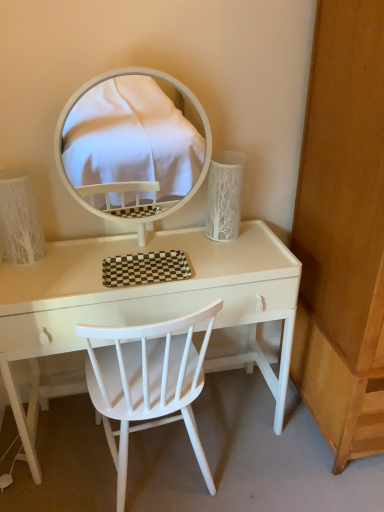
At what (x,y) coordinates should I click in order to perform the action: click on wooden dresser at right. Please return your answer as a coordinate pair (x, y). Image resolution: width=384 pixels, height=512 pixels. Looking at the image, I should click on (343, 231).

The width and height of the screenshot is (384, 512). I want to click on white glossy mirror at upper center, so click(132, 139).

What do you see at coordinates (148, 382) in the screenshot?
I see `white wood chair at center` at bounding box center [148, 382].

In order to face white glossy table at center, should I rotate leftwards or rightwards?

Rotate left and turn 4.950 degrees.

What do you see at coordinates (143, 305) in the screenshot? I see `white glossy table at center` at bounding box center [143, 305].

What do you see at coordinates (224, 195) in the screenshot? I see `white textured vase at right, which is the first table lamp from right to left` at bounding box center [224, 195].

Identify the location of wooden dresser at right. The width and height of the screenshot is (384, 512). (343, 231).

Which of these two, wooden dresser at right or white textured vase at right, which is the 2th table lamp from left to right, stands shorter?

Standing shorter between the two is white textured vase at right, which is the 2th table lamp from left to right.

From the picture: Between wooden dresser at right and white textured vase at right, which is the 2th table lamp from left to right, which one appears on the right side from the viewer's perspective?

wooden dresser at right.

Based on their sizes in the image, would you say wooden dresser at right is bigger or smaller than white textured vase at right, which is the first table lamp from right to left?

Clearly, wooden dresser at right is larger in size than white textured vase at right, which is the first table lamp from right to left.

Are wooden dresser at right and white textured vase at right, which is the first table lamp from right to left, beside each other?

No, wooden dresser at right is not touching white textured vase at right, which is the first table lamp from right to left.

The width and height of the screenshot is (384, 512). I want to click on dresser on the right of white glossy mirror at upper center, so click(343, 231).

In terms of size, does white glossy mirror at upper center appear bigger or smaller than wooden dresser at right?

Considering their sizes, white glossy mirror at upper center takes up less space than wooden dresser at right.

How distant is white glossy mirror at upper center from wooden dresser at right?

white glossy mirror at upper center is 4.98 feet away from wooden dresser at right.

Is white wood chair at center further to the viewer compared to white textured vase at right, which is the first table lamp from right to left?

No.

From the image's perspective, is white wood chair at center on top of white textured vase at right, which is the 2th table lamp from left to right?

Actually, white wood chair at center appears below white textured vase at right, which is the 2th table lamp from left to right, in the image.

Do you think white wood chair at center is within white textured vase at right, which is the first table lamp from right to left, or outside of it?

white wood chair at center is outside white textured vase at right, which is the first table lamp from right to left.

Can you tell me how much white wood chair at center and white textured vase at right, which is the first table lamp from right to left, differ in facing direction?

The angle between the facing direction of white wood chair at center and the facing direction of white textured vase at right, which is the first table lamp from right to left, is 180 degrees.

Locate an element on the screen. table lamp in front of the white textured vase at right, which is the 2th table lamp from left to right is located at coordinates (20, 219).

Which of these two, white textured lampshade at left, which appears as the 2th table lamp when viewed from the right, or white textured vase at right, which is the 2th table lamp from left to right, is bigger?

white textured vase at right, which is the 2th table lamp from left to right, is bigger.

Looking at this image, in the image, is white textured lampshade at left, marked as the first table lamp in a left-to-right arrangement, positioned in front of or behind white textured vase at right, which is the 2th table lamp from left to right?

white textured lampshade at left, marked as the first table lamp in a left-to-right arrangement, is positioned closer to the viewer than white textured vase at right, which is the 2th table lamp from left to right.

Would you say white textured lampshade at left, which appears as the 2th table lamp when viewed from the right, is inside or outside white textured vase at right, which is the first table lamp from right to left?

white textured lampshade at left, which appears as the 2th table lamp when viewed from the right, is outside white textured vase at right, which is the first table lamp from right to left.

Does white textured lampshade at left, marked as the first table lamp in a left-to-right arrangement, appear on the right side of white glossy mirror at upper center?

No, white textured lampshade at left, marked as the first table lamp in a left-to-right arrangement, is not to the right of white glossy mirror at upper center.

Which of these two, white textured lampshade at left, which appears as the 2th table lamp when viewed from the right, or white glossy mirror at upper center, stands shorter?

white textured lampshade at left, which appears as the 2th table lamp when viewed from the right.

Is white textured lampshade at left, which appears as the 2th table lamp when viewed from the right, positioned behind white glossy mirror at upper center?

Yes.

Does white textured lampshade at left, marked as the first table lamp in a left-to-right arrangement, have a smaller size compared to white glossy mirror at upper center?

Yes, white textured lampshade at left, marked as the first table lamp in a left-to-right arrangement, is smaller than white glossy mirror at upper center.

Considering the sizes of objects white wood chair at center and white glossy table at center in the image provided, who is bigger, white wood chair at center or white glossy table at center?

white glossy table at center is bigger.

Between white wood chair at center and white glossy table at center, which one appears on the right side from the viewer's perspective?

white glossy table at center.

Could white glossy table at center be considered to be inside white wood chair at center?

Actually, white glossy table at center is outside white wood chair at center.

Considering the sizes of white textured vase at right, which is the 2th table lamp from left to right, and wooden dresser at right in the image, is white textured vase at right, which is the 2th table lamp from left to right, wider or thinner than wooden dresser at right?

Clearly, white textured vase at right, which is the 2th table lamp from left to right, has less width compared to wooden dresser at right.

Is point (212, 166) behind point (340, 214)?

Yes, point (212, 166) is behind point (340, 214).

Is white textured vase at right, which is the 2th table lamp from left to right, completely or partially outside of wooden dresser at right?

white textured vase at right, which is the 2th table lamp from left to right, lies outside wooden dresser at right's area.

From a real-world perspective, between white textured vase at right, which is the 2th table lamp from left to right, and wooden dresser at right, who is vertically lower?

In real-world perspective, wooden dresser at right is lower.

I want to click on the 2nd table lamp located above the wooden dresser at right (from a real-world perspective), so click(x=224, y=195).

Where is `dresser located below the white glossy mirror at upper center (from the image's perspective)`? dresser located below the white glossy mirror at upper center (from the image's perspective) is located at coordinates (343, 231).

Considering their positions, is white textured vase at right, which is the 2th table lamp from left to right, positioned further to white textured lampshade at left, marked as the first table lamp in a left-to-right arrangement, than wooden dresser at right?

wooden dresser at right lies further to white textured lampshade at left, marked as the first table lamp in a left-to-right arrangement, than the other object.

Based on their spatial positions, is wooden dresser at right or white glossy table at center further from white glossy mirror at upper center?

wooden dresser at right is further to white glossy mirror at upper center.

Considering their positions, is white glossy table at center positioned closer to white textured vase at right, which is the first table lamp from right to left, than white glossy mirror at upper center?

The object closer to white textured vase at right, which is the first table lamp from right to left, is white glossy table at center.

Looking at the image, which one is located closer to wooden dresser at right, white textured vase at right, which is the first table lamp from right to left, or white glossy mirror at upper center?

white textured vase at right, which is the first table lamp from right to left, lies closer to wooden dresser at right than the other object.

Considering their positions, is white glossy mirror at upper center positioned further to wooden dresser at right than white textured lampshade at left, which appears as the 2th table lamp when viewed from the right?

Among the two, white glossy mirror at upper center is located further to wooden dresser at right.

Which object lies further to the anchor point white textured vase at right, which is the 2th table lamp from left to right, white wood chair at center or white textured lampshade at left, which appears as the 2th table lamp when viewed from the right?

white textured lampshade at left, which appears as the 2th table lamp when viewed from the right, is further to white textured vase at right, which is the 2th table lamp from left to right.

Looking at the image, which one is located further to wooden dresser at right, white textured lampshade at left, which appears as the 2th table lamp when viewed from the right, or white glossy table at center?

The object further to wooden dresser at right is white textured lampshade at left, which appears as the 2th table lamp when viewed from the right.

From the image, which object appears to be nearer to white textured vase at right, which is the first table lamp from right to left, white glossy table at center or white wood chair at center?

white glossy table at center is closer to white textured vase at right, which is the first table lamp from right to left.

Identify the location of table lamp between white glossy table at center and wooden dresser at right. (224, 195).

You are a GUI agent. You are given a task and a screenshot of the screen. Output one action in this format:
    pyautogui.click(x=<x>, y=<y>)
    Task: Click on the table situated between white textured lampshade at left, which appears as the 2th table lamp when viewed from the right, and white textured vase at right, which is the first table lamp from right to left, from left to right
    The image size is (384, 512).
    Given the screenshot: What is the action you would take?
    pyautogui.click(x=143, y=305)

The width and height of the screenshot is (384, 512). Identify the location of chair between white textured lampshade at left, marked as the first table lamp in a left-to-right arrangement, and white textured vase at right, which is the 2th table lamp from left to right, from left to right. (148, 382).

This screenshot has width=384, height=512. Identify the location of table between white textured lampshade at left, which appears as the 2th table lamp when viewed from the right, and wooden dresser at right, in the horizontal direction. (143, 305).